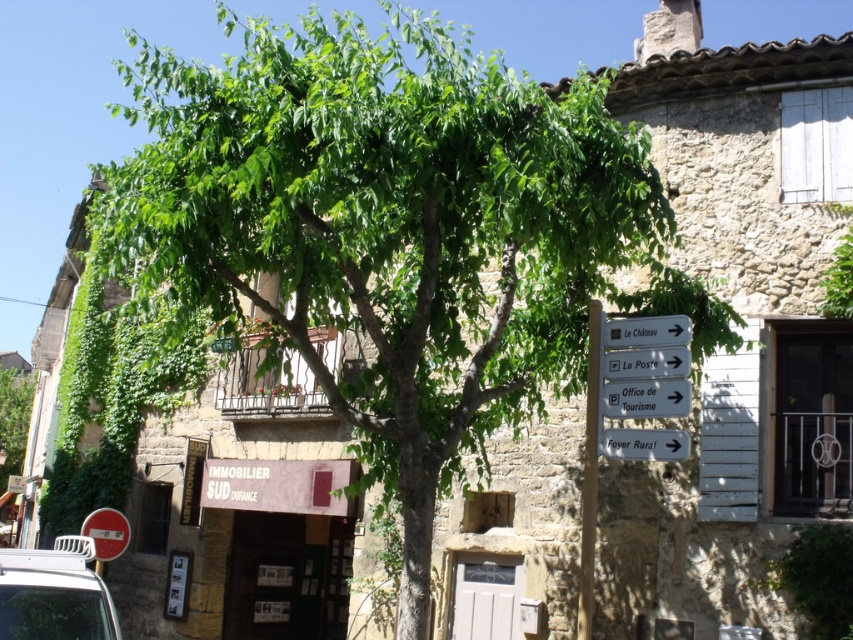
You are standing in the village square and want to reach the point at coordinates point (x=683, y=371). If your walking speed is 1.5 meters per second, how many seconds will it take you to reach that point?

The distance between you and the point (x=683, y=371) is 6.26 meters. At a speed of 1.5 meters per second, it will take approximately 4.17 seconds to reach the point.

You are standing on the street in front of the tree and the stone building. There is a white plastic sign at center. If you want to reach the sign, how many steps would you need to take forward from your current position?

The white plastic sign at center is 20.43 feet away. Assuming an average step length of about 2.5 feet, you would need to take approximately 8 steps forward to reach it.